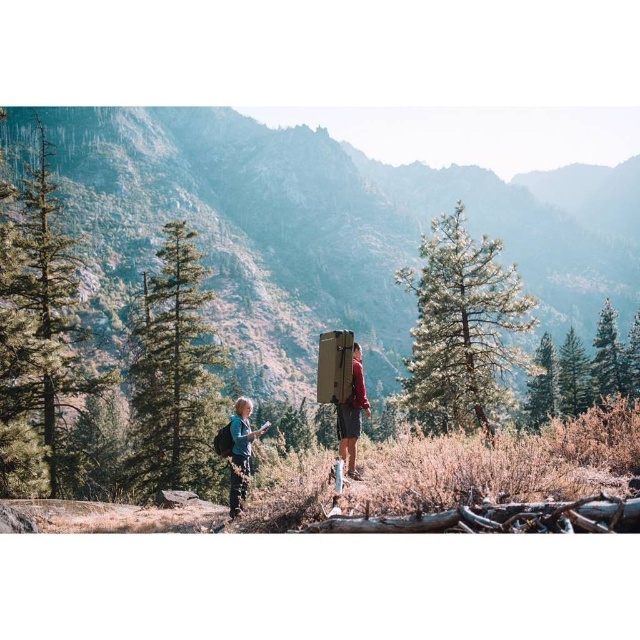
Which is above, green matte pine at left or blue denim jacket at center?

green matte pine at left is higher up.

Image resolution: width=640 pixels, height=640 pixels. Identify the location of green matte pine at left. (173, 374).

Locate an element on the screen. green matte pine at left is located at coordinates (173, 374).

Does brown wooden sign at center appear on the right side of green matte pine at upper right?

No, brown wooden sign at center is not to the right of green matte pine at upper right.

Which is above, brown wooden sign at center or green matte pine at upper right?

brown wooden sign at center is higher up.

Is point (548, 248) closer to viewer compared to point (598, 392)?

No, it is behind (598, 392).

Where is `brown wooden sign at center`? The image size is (640, 640). brown wooden sign at center is located at coordinates (324, 225).

Is green matte pine at upper right smaller than blue denim jacket at center?

Actually, green matte pine at upper right might be larger than blue denim jacket at center.

Measure the distance between green matte pine at upper right and camera.

green matte pine at upper right and camera are 64.10 meters apart.

I want to click on green matte pine at upper right, so click(608, 356).